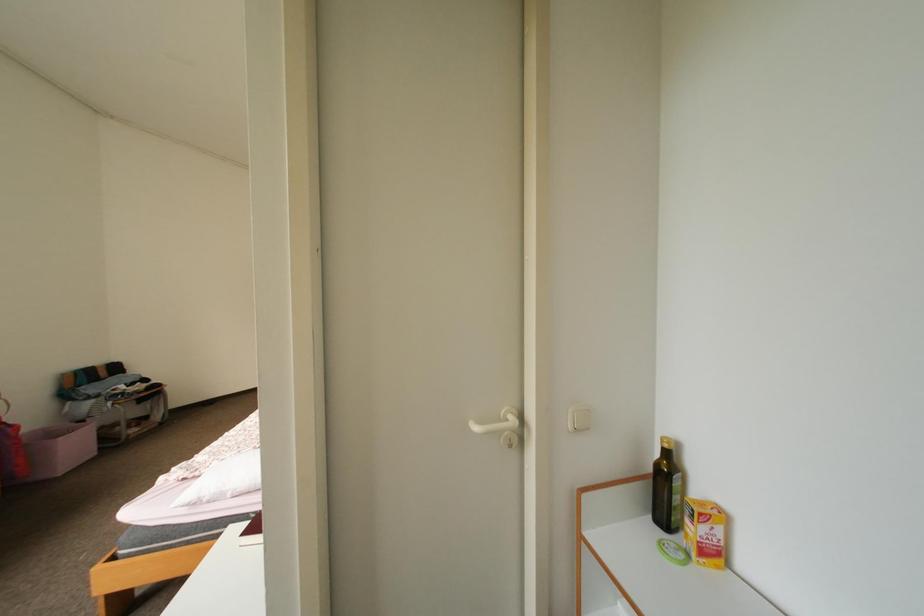
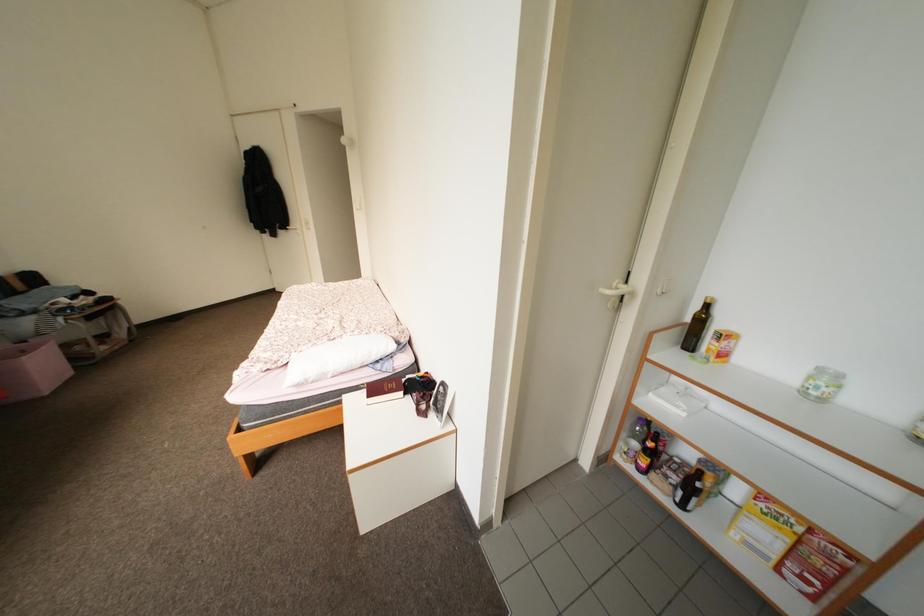
Question: In a continuous first-person perspective shot, in which direction is the camera moving?

Choices:
 (A) Left
 (B) Right
 (C) Forward
 (D) Backward

Answer: (A)